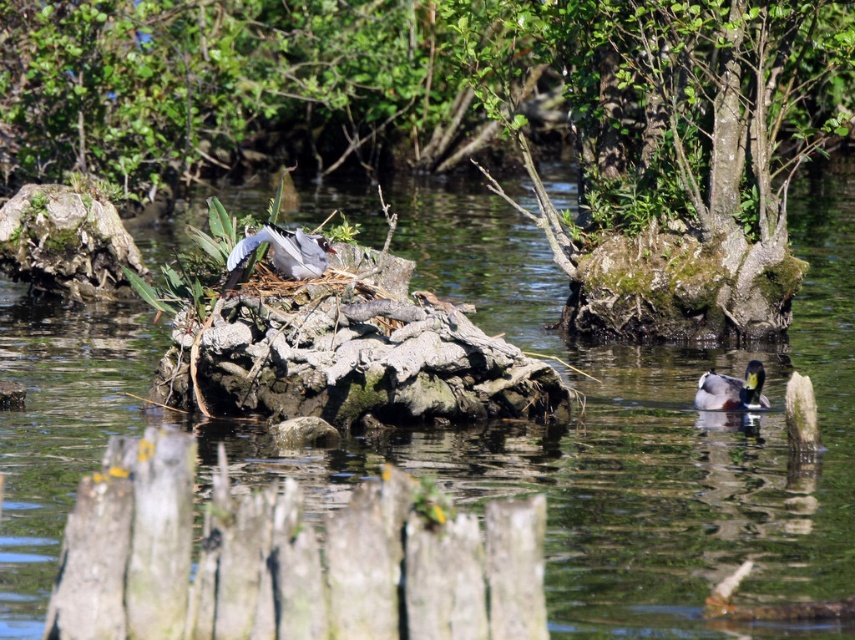
Based on the photo, does green mossy rock at center have a lesser height compared to white feathered bird at center?

In fact, green mossy rock at center may be taller than white feathered bird at center.

What do you see at coordinates (472, 120) in the screenshot? I see `green mossy rock at center` at bounding box center [472, 120].

What do you see at coordinates (472, 120) in the screenshot? I see `green mossy rock at center` at bounding box center [472, 120].

Where is `green mossy rock at center`? The image size is (855, 640). green mossy rock at center is located at coordinates (472, 120).

Is green mossy tree at upper center positioned behind white feathered bird at center?

That is True.

In the scene shown: Can you confirm if green mossy tree at upper center is smaller than white feathered bird at center?

No, green mossy tree at upper center is not smaller than white feathered bird at center.

Find the location of a particular element. Image resolution: width=855 pixels, height=640 pixels. green mossy tree at upper center is located at coordinates (671, 148).

Between white feathered bird at center and green glossy duck at lower right, which one appears on the right side from the viewer's perspective?

Positioned to the right is green glossy duck at lower right.

Is point (225, 284) less distant than point (724, 406)?

Yes.

Identify the location of white feathered bird at center. This screenshot has height=640, width=855. (282, 252).